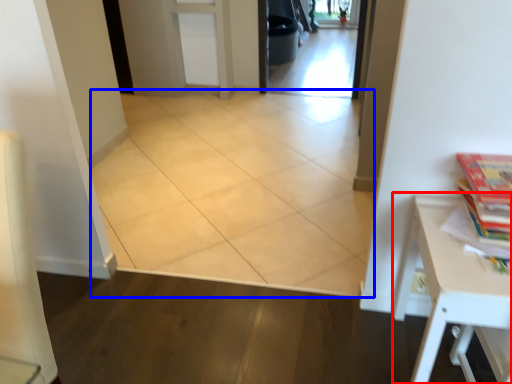
Question: Which point is closer to the camera, table (highlighted by a red box) or ceramic tile (highlighted by a blue box)?

Choices:
 (A) table
 (B) ceramic tile

Answer: (A)